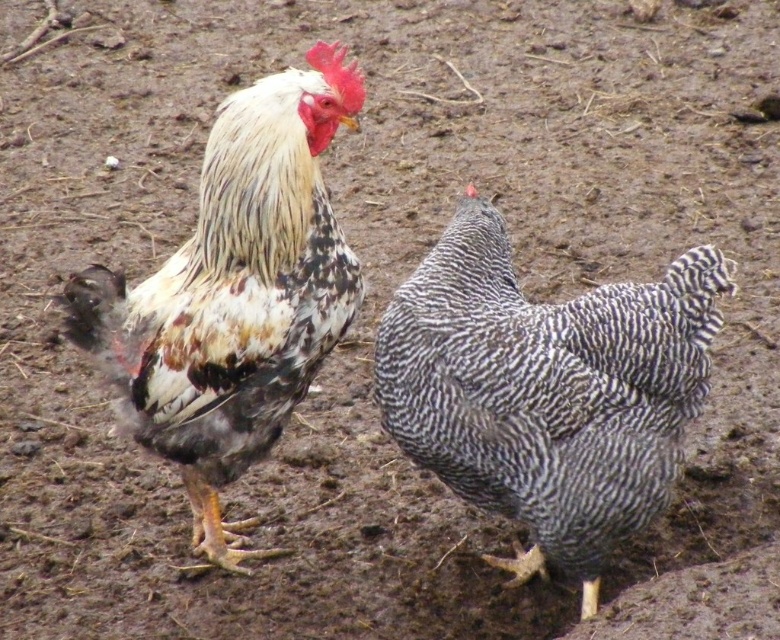
You are a farmer checking the chicken coop and notice the speckled feathered hen at center. Based on its position coordinates, can you determine if it is closer to the left or right side of the coop?

The speckled feathered hen at center is located at point 0.611 on the x and 0.701 on the y, which means it is closer to the right side of the coop since the x coordinate is higher than 0.5.